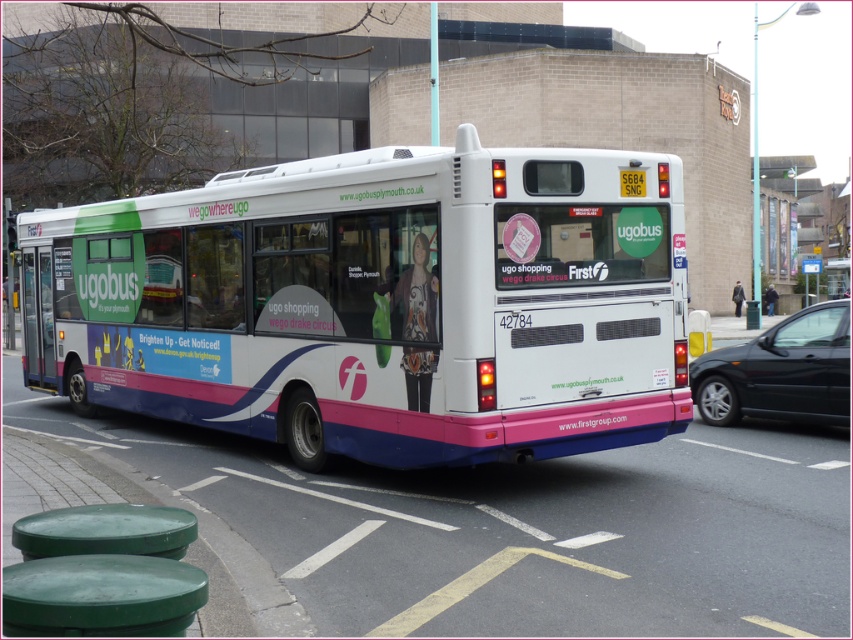
You are standing on the sidewalk next to the white bus with pink and blue accents. There are two points marked on the bus, one at coordinate point (378, 333) and another at point (805, 419). Which point is closer to you?

Point (378, 333) is closer to the camera than point (805, 419).

You are a pedestrian standing on the sidewalk. You see the white matte bus at center and the yellow plastic license plate at rear center. Which object is closer to the sidewalk?

The white matte bus at center is closer to the sidewalk because it is positioned on the left side of the yellow plastic license plate at rear center, implying it is nearer in the scene.

You are a pedestrian standing on the sidewalk. You see the black glossy car at right and the yellow plastic license plate at rear center. Which object is closer to you?

The black glossy car at right is closer to you because it is positioned under the yellow plastic license plate at rear center, meaning it is in front of the license plate from your viewpoint.